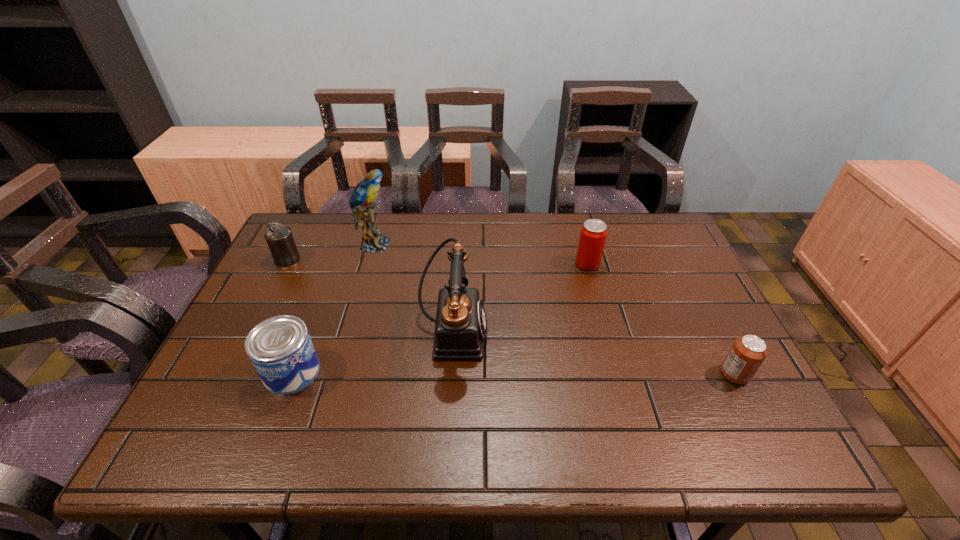
The height and width of the screenshot is (540, 960). Identify the location of free spot between the second can from right to left and the telephone. (520, 297).

Locate which object is the fifth closest to the parrot. Please provide its 2D coordinates. Your answer should be formatted as a tuple, i.e. [(x, y)], where the tuple contains the x and y coordinates of a point satisfying the conditions above.

[(748, 352)]

Find the location of a particular element. This screenshot has width=960, height=540. the closest object to the rightmost can is located at coordinates pos(593,234).

Identify which can is the third closest to the leftmost can. Please provide its 2D coordinates. Your answer should be formatted as a tuple, i.e. [(x, y)], where the tuple contains the x and y coordinates of a point satisfying the conditions above.

[(748, 352)]

This screenshot has width=960, height=540. Identify the location of the second closest can to the third object from right to left. (593, 234).

Locate an element on the screen. This screenshot has height=540, width=960. free space that satisfies the following two spatial constraints: 1. on the face of the parrot; 2. on the back side of the fifth object from left to right is located at coordinates (369, 264).

Find the location of a particular element. This screenshot has width=960, height=540. vacant space that satisfies the following two spatial constraints: 1. on the face of the third can from left to right; 2. on the left side of the tallest object is located at coordinates (369, 264).

The width and height of the screenshot is (960, 540). In order to click on blank area in the image that satisfies the following two spatial constraints: 1. on the front of the rightmost can at the rotary dial; 2. on the left side of the fourth object from left to right in this screenshot , I will do `click(450, 374)`.

The height and width of the screenshot is (540, 960). In order to click on free space that satisfies the following two spatial constraints: 1. on the face of the rightmost object; 2. on the left side of the tallest object in this screenshot , I will do `click(337, 374)`.

You are a GUI agent. You are given a task and a screenshot of the screen. Output one action in this format:
    pyautogui.click(x=<x>, y=<y>)
    Task: Click on the vacant space that satisfies the following two spatial constraints: 1. on the front side of the fifth object from left to right; 2. on the front label of the third can from right to left
    This screenshot has width=960, height=540.
    Given the screenshot: What is the action you would take?
    pyautogui.click(x=617, y=372)